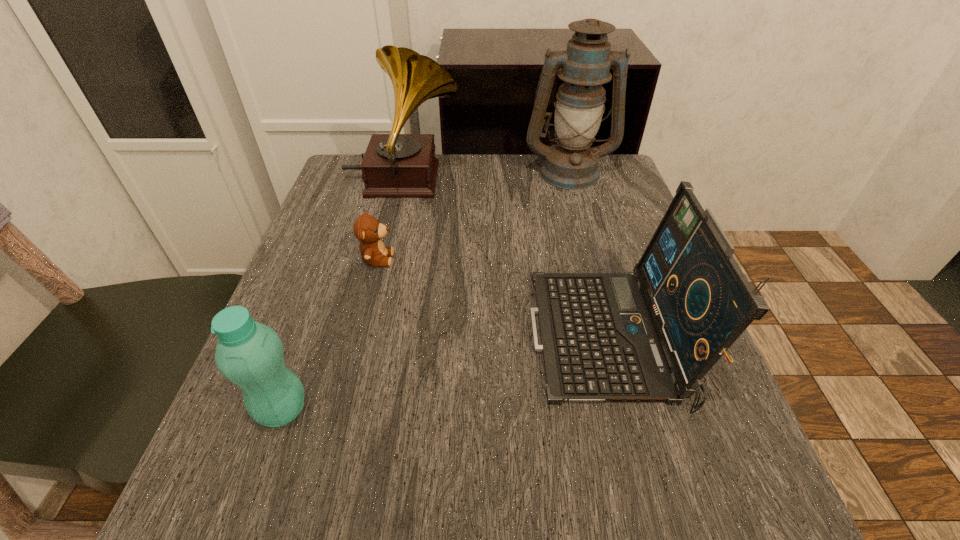
Where is `vacant space located 0.380m on the front-facing side of the laptop computer`? The height and width of the screenshot is (540, 960). vacant space located 0.380m on the front-facing side of the laptop computer is located at coordinates [x=311, y=339].

The width and height of the screenshot is (960, 540). What are the coordinates of `free spot located 0.390m on the right of the bottle` in the screenshot? It's located at (567, 410).

Find the location of a particular element. blank space located on the face of the teddy bear is located at coordinates (540, 259).

Locate an element on the screen. Image resolution: width=960 pixels, height=540 pixels. oil lamp at the far edge is located at coordinates [x=585, y=65].

In order to click on phonograph record that is at the far edge in this screenshot , I will do click(394, 165).

Image resolution: width=960 pixels, height=540 pixels. In order to click on phonograph record that is at the left edge in this screenshot , I will do `click(394, 165)`.

Locate an element on the screen. The image size is (960, 540). bottle at the left edge is located at coordinates (249, 354).

Where is `teddy bear located in the left edge section of the desktop`? The height and width of the screenshot is (540, 960). teddy bear located in the left edge section of the desktop is located at coordinates (367, 229).

Where is `oil lamp situated at the right edge`? The width and height of the screenshot is (960, 540). oil lamp situated at the right edge is located at coordinates (585, 65).

At what (x,y) coordinates should I click in order to perform the action: click on laptop computer present at the right edge. Please return your answer as a coordinate pair (x, y). Image resolution: width=960 pixels, height=540 pixels. Looking at the image, I should click on click(x=651, y=335).